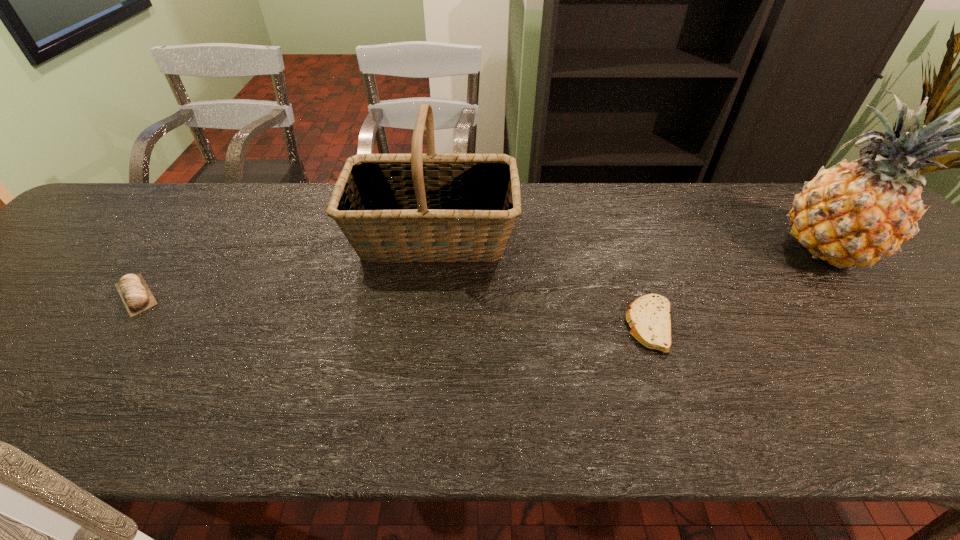
Where is `pineapple`? pineapple is located at coordinates (854, 213).

Image resolution: width=960 pixels, height=540 pixels. I want to click on the rightmost object, so click(854, 213).

I want to click on the third object from right to left, so click(x=416, y=207).

At what (x,y) coordinates should I click in order to perform the action: click on basket. Please return your answer as a coordinate pair (x, y). Image resolution: width=960 pixels, height=540 pixels. Looking at the image, I should click on (416, 207).

You are a GUI agent. You are given a task and a screenshot of the screen. Output one action in this format:
    pyautogui.click(x=<x>, y=<y>)
    Task: Click on the left pita bread
    This screenshot has width=960, height=540.
    Given the screenshot: What is the action you would take?
    pyautogui.click(x=133, y=290)

Where is `the taller pita bread`? The width and height of the screenshot is (960, 540). the taller pita bread is located at coordinates (133, 290).

This screenshot has width=960, height=540. What are the coordinates of `the shortest object` in the screenshot? It's located at (648, 316).

Where is `the right pita bread`? The width and height of the screenshot is (960, 540). the right pita bread is located at coordinates (648, 316).

The width and height of the screenshot is (960, 540). In order to click on free space located 0.230m on the left of the pineapple in this screenshot , I will do [690, 251].

You are a GUI agent. You are given a task and a screenshot of the screen. Output one action in this format:
    pyautogui.click(x=<x>, y=<y>)
    Task: Click on the vacant space located by the handle of the third object from right to left
    The image size is (960, 540).
    Given the screenshot: What is the action you would take?
    pyautogui.click(x=605, y=236)